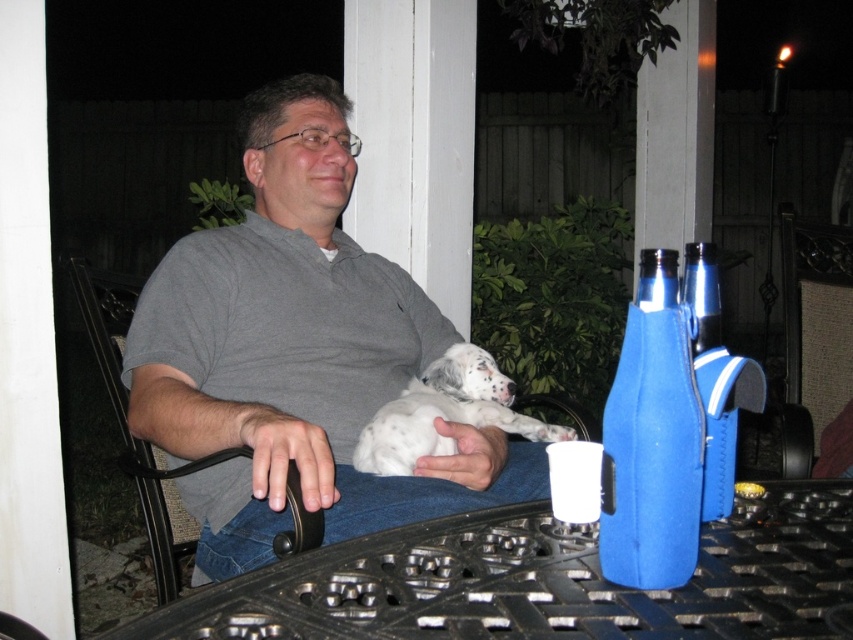
You are a delivery robot with a 1.5 meter wide package. You need to navigate from the front yard to the backyard where the white soft fur dog at center and the shiny metallic bottle at right are located. Can you pass through the space between them without moving either object?

The distance between the white soft fur dog at center and the shiny metallic bottle at right is 2.90 meters. Since the package is 1.5 meters wide, there is enough space for the robot to pass through the gap between them.

You are a photographer adjusting your camera focus. You notice two points in the scene labeled as point (x=840, y=317) and point (x=466, y=349). Which of these points is closer to the camera lens?

Point (x=840, y=317) is further to the camera than point (x=466, y=349), so the point closer to the camera lens is point (x=466, y=349).

You are a photographer trying to capture the white soft fur dog at center and the black plastic chair at lower right in the same frame. Based on their positions, will the dog be visible in front of or behind the chair in the photo?

The white soft fur dog at center is behind the black plastic chair at lower right, so in the photo, the dog will appear behind the chair.